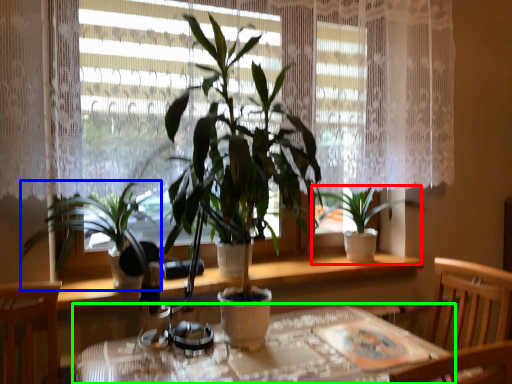
Question: Considering the real-world distances, which object is farthest from houseplant (highlighted by a red box)? houseplant (highlighted by a blue box) or table (highlighted by a green box)?

Choices:
 (A) houseplant
 (B) table

Answer: (A)